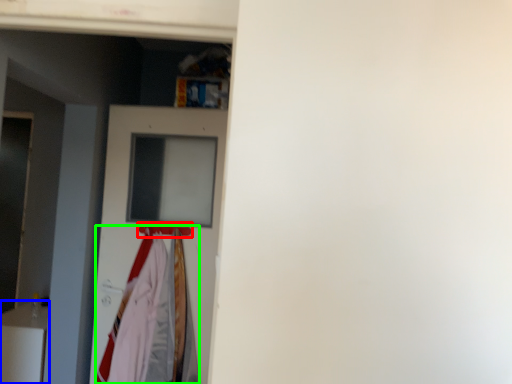
Question: Which is farther away from hanger (highlighted by a red box)? furniture (highlighted by a blue box) or clothing (highlighted by a green box)?

Choices:
 (A) furniture
 (B) clothing

Answer: (A)